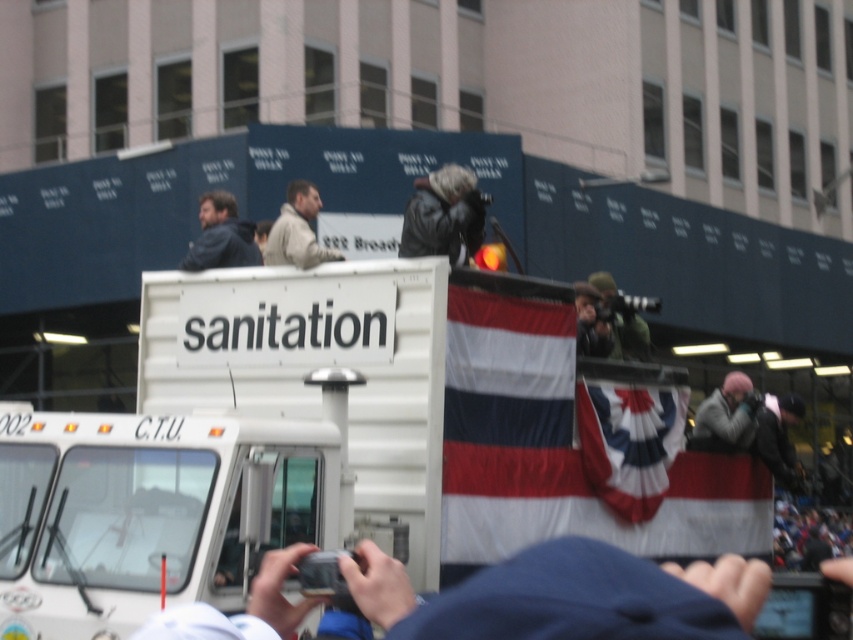
At what (x,y) coordinates should I click in order to perform the action: click on red and white striped fabric at upper right. Please return your answer as a coordinate pair (x, y). Looking at the image, I should click on (575, 451).

Is point (566, 336) in front of point (332, 252)?

No, it is behind (332, 252).

Find the location of a particular element. The height and width of the screenshot is (640, 853). red and white striped fabric at upper right is located at coordinates (575, 451).

Is leather jacket at center shorter than dark blue jacket at upper left?

Yes, leather jacket at center is shorter than dark blue jacket at upper left.

Who is more distant from viewer, [451,225] or [254,248]?

Positioned behind is point [254,248].

What do you see at coordinates (444, 216) in the screenshot? The width and height of the screenshot is (853, 640). I see `leather jacket at center` at bounding box center [444, 216].

Identify the location of leather jacket at center. This screenshot has width=853, height=640. (444, 216).

Is red fabric flag at center wider than light beige jacket at center?

Correct, the width of red fabric flag at center exceeds that of light beige jacket at center.

Can you confirm if red fabric flag at center is taller than light beige jacket at center?

Indeed, red fabric flag at center has a greater height compared to light beige jacket at center.

Between point (636, 509) and point (277, 230), which one is positioned in front?

Point (277, 230) is in front.

I want to click on red fabric flag at center, so click(630, 442).